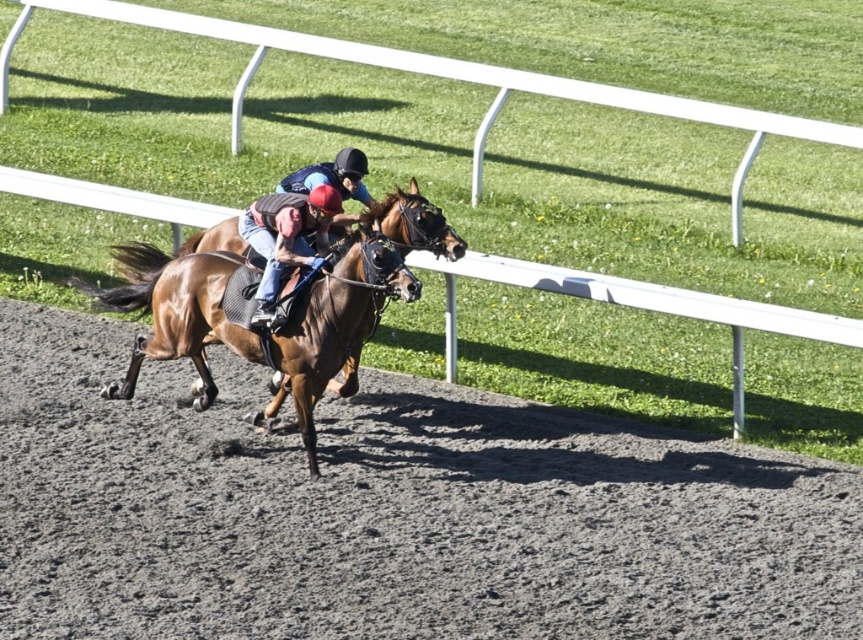
Question: Is the position of brown dirt track at center more distant than that of brown glossy horse at center?

Choices:
 (A) yes
 (B) no

Answer: (B)

Question: Which of the following is the farthest from the observer?

Choices:
 (A) brown glossy horse at center
 (B) white plastic rail at center
 (C) brown dirt track at center
 (D) leather helmet at center

Answer: (B)

Question: Which is nearer to the leather helmet at center?

Choices:
 (A) white plastic rail at center
 (B) brown glossy horse at center
 (C) brown dirt track at center

Answer: (B)

Question: Can you confirm if brown glossy horse at center is wider than leather helmet at center?

Choices:
 (A) no
 (B) yes

Answer: (B)

Question: Observing the image, what is the correct spatial positioning of white plastic rail at center in reference to brown glossy horse at center?

Choices:
 (A) left
 (B) right

Answer: (A)

Question: Among these objects, which one is nearest to the camera?

Choices:
 (A) brown glossy horse at center
 (B) leather helmet at center

Answer: (A)